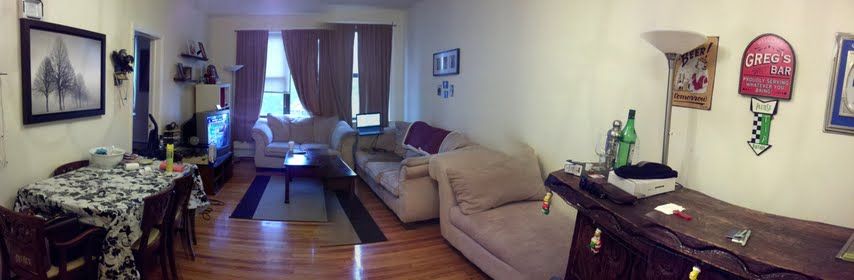
Locate an element on the screen. The width and height of the screenshot is (854, 280). couches is located at coordinates (x=377, y=155), (x=306, y=133), (x=506, y=214).